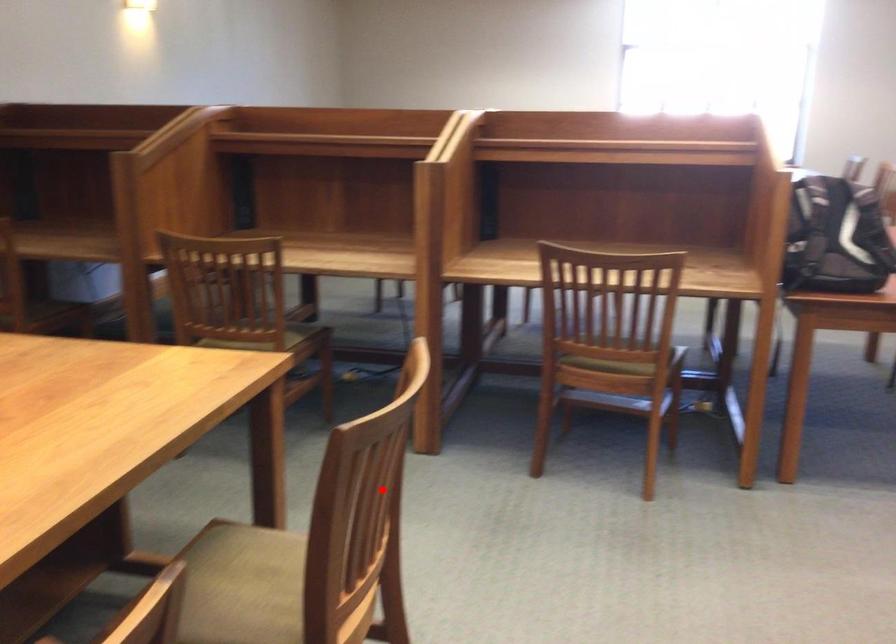
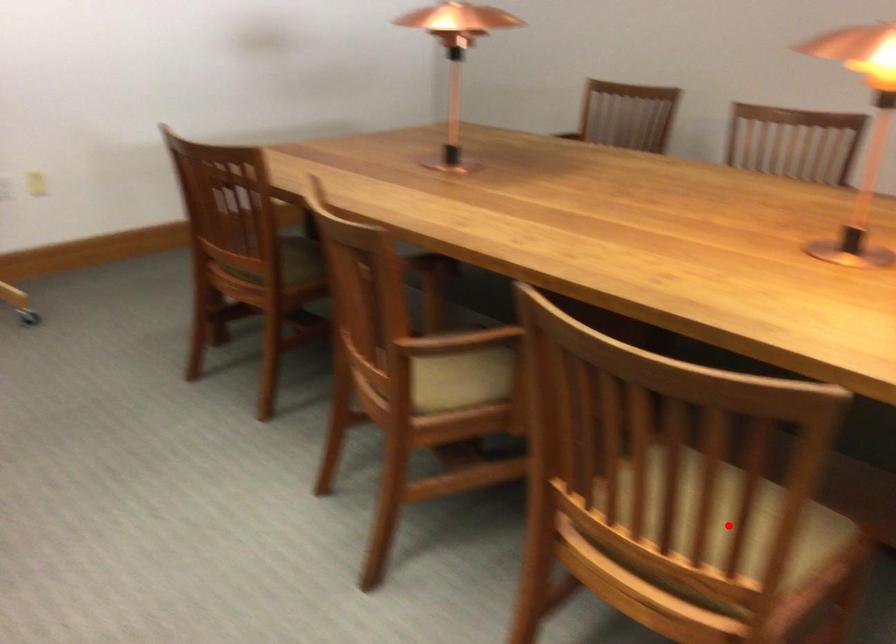
From the picture: I am providing you with two images of the same scene from different viewpoints. A red point is marked on the first image and another point is marked on the second image. Is the marked point in image1 the same physical position as the marked point in image2?

Yes